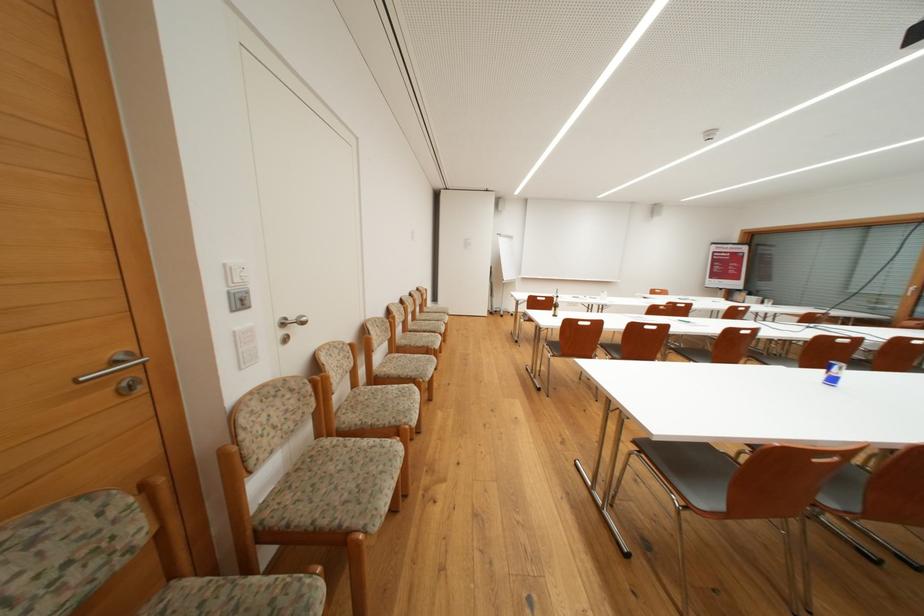
Describe the element at coordinates (554, 306) in the screenshot. This screenshot has height=616, width=924. I see `the brown glass bottle` at that location.